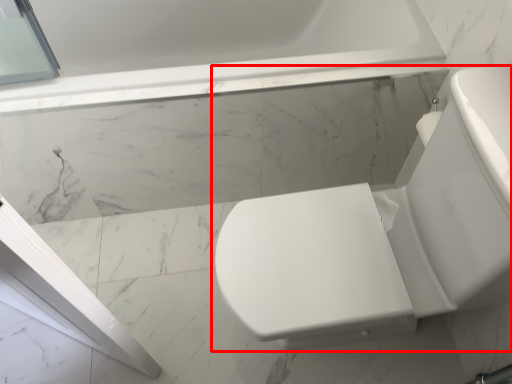
Question: From the image's perspective, where is toilet (annotated by the red box) located in relation to bathtub in the image?

Choices:
 (A) below
 (B) above

Answer: (A)